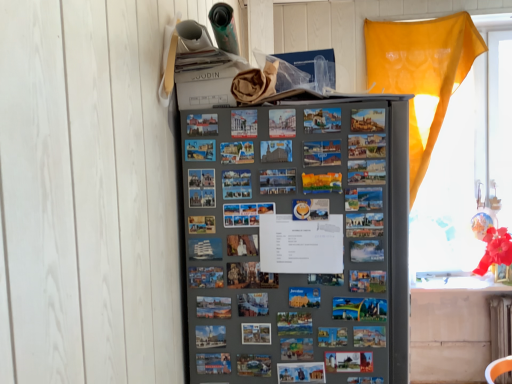
You are a GUI agent. You are given a task and a screenshot of the screen. Output one action in this format:
    pyautogui.click(x=<x>, y=<y>)
    Task: Click on the translucent yellow curtain at right
    The height and width of the screenshot is (384, 512).
    Given the screenshot: What is the action you would take?
    click(468, 172)

Where is `metallic gray refrigerator at center`? The height and width of the screenshot is (384, 512). metallic gray refrigerator at center is located at coordinates pyautogui.click(x=298, y=240).

From the image's perspective, which is above, translucent yellow curtain at right or white painted metal radiator at lower right?

translucent yellow curtain at right is shown above in the image.

Considering the relative positions of translucent yellow curtain at right and white painted metal radiator at lower right in the image provided, is translucent yellow curtain at right to the right of white painted metal radiator at lower right from the viewer's perspective?

Incorrect, translucent yellow curtain at right is not on the right side of white painted metal radiator at lower right.

Identify the location of window behind the white painted metal radiator at lower right. This screenshot has height=384, width=512. (468, 172).

The image size is (512, 384). I want to click on radiator behind the metallic gray refrigerator at center, so [500, 326].

Considering the sizes of metallic gray refrigerator at center and white painted metal radiator at lower right in the image, is metallic gray refrigerator at center taller or shorter than white painted metal radiator at lower right?

In the image, metallic gray refrigerator at center appears to be taller than white painted metal radiator at lower right.

Is point (210, 150) closer to camera compared to point (503, 322)?

That is True.

Which is more to the left, metallic gray refrigerator at center or white painted metal radiator at lower right?

From the viewer's perspective, metallic gray refrigerator at center appears more on the left side.

Which is nearer, (x=292, y=333) or (x=451, y=227)?

Point (x=292, y=333).

Would you say metallic gray refrigerator at center is outside translucent yellow curtain at right?

Indeed, metallic gray refrigerator at center is completely outside translucent yellow curtain at right.

Which object is wider, metallic gray refrigerator at center or translucent yellow curtain at right?

With larger width is metallic gray refrigerator at center.

Considering the relative sizes of metallic gray refrigerator at center and translucent yellow curtain at right in the image provided, is metallic gray refrigerator at center taller than translucent yellow curtain at right?

In fact, metallic gray refrigerator at center may be shorter than translucent yellow curtain at right.

Looking at their sizes, would you say white painted metal radiator at lower right is wider or thinner than translucent yellow curtain at right?

white painted metal radiator at lower right is wider than translucent yellow curtain at right.

Which of these two, white painted metal radiator at lower right or translucent yellow curtain at right, stands taller?

Standing taller between the two is translucent yellow curtain at right.

In the scene shown: Between white painted metal radiator at lower right and translucent yellow curtain at right, which one appears on the right side from the viewer's perspective?

white painted metal radiator at lower right is more to the right.

Based on the photo, is white painted metal radiator at lower right beside translucent yellow curtain at right?

No, white painted metal radiator at lower right is not touching translucent yellow curtain at right.

From a real-world perspective, is white painted metal radiator at lower right physically above metallic gray refrigerator at center?

Actually, white painted metal radiator at lower right is physically below metallic gray refrigerator at center in the real world.

Considering the sizes of objects white painted metal radiator at lower right and metallic gray refrigerator at center in the image provided, who is taller, white painted metal radiator at lower right or metallic gray refrigerator at center?

Standing taller between the two is metallic gray refrigerator at center.

Could you tell me if white painted metal radiator at lower right is turned towards metallic gray refrigerator at center?

No, white painted metal radiator at lower right is not facing towards metallic gray refrigerator at center.

Is white painted metal radiator at lower right placed right next to metallic gray refrigerator at center?

There is a gap between white painted metal radiator at lower right and metallic gray refrigerator at center.

Does translucent yellow curtain at right turn towards metallic gray refrigerator at center?

No, translucent yellow curtain at right does not turn towards metallic gray refrigerator at center.

I want to click on window on the right of the metallic gray refrigerator at center, so click(x=468, y=172).

Which of these two, translucent yellow curtain at right or metallic gray refrigerator at center, is thinner?

translucent yellow curtain at right is thinner.

From the image's perspective, between translucent yellow curtain at right and metallic gray refrigerator at center, who is located below?

metallic gray refrigerator at center appears lower in the image.

At what (x,y) coordinates should I click in order to perform the action: click on window above the white painted metal radiator at lower right (from the image's perspective). Please return your answer as a coordinate pair (x, y). Image resolution: width=512 pixels, height=384 pixels. Looking at the image, I should click on (468, 172).

Locate an element on the screen. The height and width of the screenshot is (384, 512). refrigerator that is above the white painted metal radiator at lower right (from a real-world perspective) is located at coordinates (298, 240).

Which object lies nearer to the anchor point translucent yellow curtain at right, white painted metal radiator at lower right or metallic gray refrigerator at center?

white painted metal radiator at lower right is positioned closer to the anchor translucent yellow curtain at right.

Considering their positions, is metallic gray refrigerator at center positioned closer to white painted metal radiator at lower right than translucent yellow curtain at right?

translucent yellow curtain at right is positioned closer to the anchor white painted metal radiator at lower right.

From the image, which object appears to be farther from metallic gray refrigerator at center, white painted metal radiator at lower right or translucent yellow curtain at right?

Based on the image, white painted metal radiator at lower right appears to be further to metallic gray refrigerator at center.

When comparing their distances from translucent yellow curtain at right, does metallic gray refrigerator at center or white painted metal radiator at lower right seem further?

Among the two, metallic gray refrigerator at center is located further to translucent yellow curtain at right.

Based on their spatial positions, is translucent yellow curtain at right or metallic gray refrigerator at center closer to white painted metal radiator at lower right?

translucent yellow curtain at right is positioned closer to the anchor white painted metal radiator at lower right.

Looking at the image, which one is located closer to metallic gray refrigerator at center, translucent yellow curtain at right or white painted metal radiator at lower right?

Based on the image, translucent yellow curtain at right appears to be nearer to metallic gray refrigerator at center.

At what (x,y) coordinates should I click in order to perform the action: click on radiator between metallic gray refrigerator at center and translucent yellow curtain at right along the z-axis. Please return your answer as a coordinate pair (x, y). The width and height of the screenshot is (512, 384). Looking at the image, I should click on (500, 326).